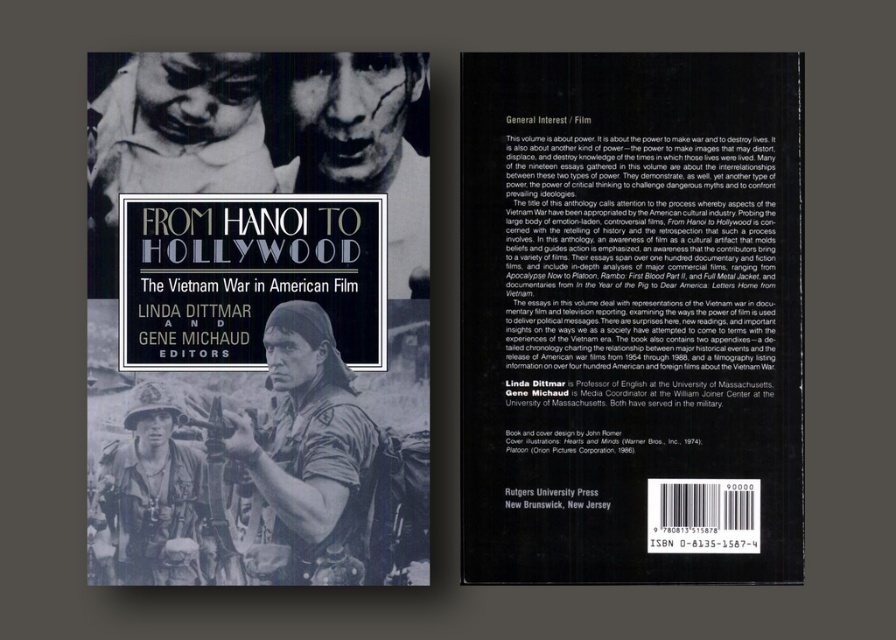
Is point (268, 483) closer to viewer compared to point (375, 132)?

Yes, it is in front of point (375, 132).

Is point (340, 561) more distant than point (378, 132)?

That is False.

Find the location of a particular element. The image size is (896, 640). grainy black-and-white soldier at center is located at coordinates (309, 460).

Who is lower down, black paper at center or grainy black-and-white soldier at center?

grainy black-and-white soldier at center is lower down.

Between black paper at center and grainy black-and-white soldier at center, which one appears on the right side from the viewer's perspective?

black paper at center is more to the right.

You are a GUI agent. You are given a task and a screenshot of the screen. Output one action in this format:
    pyautogui.click(x=<x>, y=<y>)
    Task: Click on the black paper at center
    Image resolution: width=896 pixels, height=640 pixels.
    Given the screenshot: What is the action you would take?
    pyautogui.click(x=631, y=317)

Does black paper at center appear over metallic helmet at lower left?

Yes.

Does black paper at center have a lesser width compared to metallic helmet at lower left?

No.

Find the location of a particular element. Image resolution: width=896 pixels, height=640 pixels. black paper at center is located at coordinates (631, 317).

The width and height of the screenshot is (896, 640). What are the coordinates of `black paper at center` in the screenshot? It's located at (631, 317).